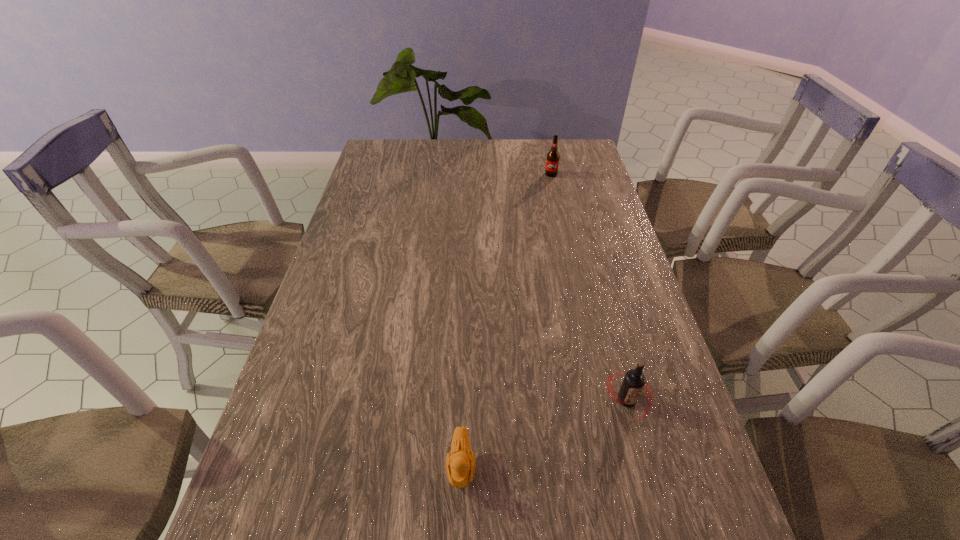
Identify the location of vacant area that lies between the nearer root beer and the farthest object. The height and width of the screenshot is (540, 960). (589, 287).

The image size is (960, 540). I want to click on object that is the nearest to the second farthest object, so click(x=460, y=464).

Identify the location of object that is the second closest to the shortest object. (552, 162).